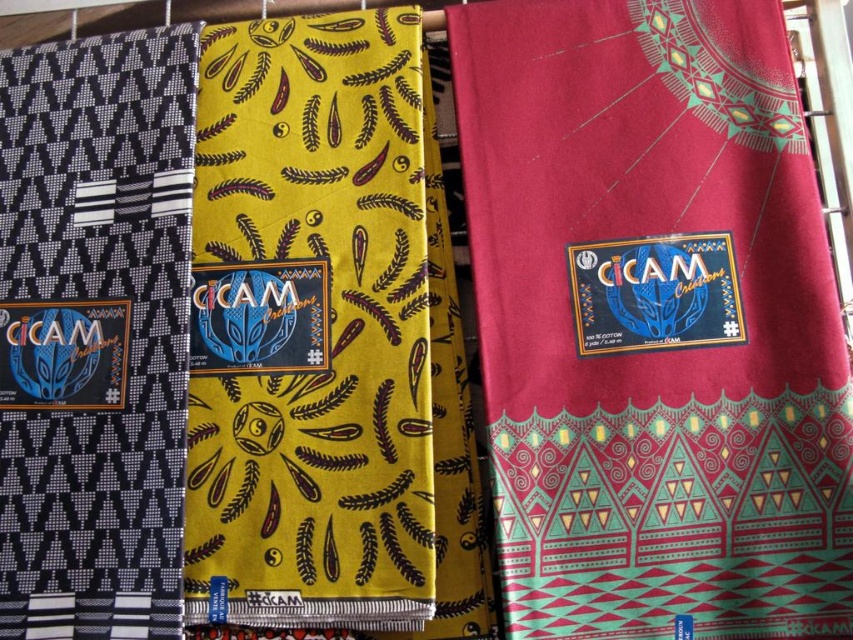
Question: Which object is farther from the camera taking this photo?

Choices:
 (A) matte red fabric at center
 (B) black woven cloth at left

Answer: (B)

Question: Considering the real-world distances, which object is closest to the black woven cloth at left?

Choices:
 (A) matte red fabric at center
 (B) yellow cotton fabric at center

Answer: (B)

Question: Estimate the real-world distances between objects in this image. Which object is closer to the yellow cotton fabric at center?

Choices:
 (A) matte red fabric at center
 (B) black woven cloth at left

Answer: (B)

Question: Can you confirm if matte red fabric at center is thinner than black woven cloth at left?

Choices:
 (A) no
 (B) yes

Answer: (A)

Question: From the image, what is the correct spatial relationship of matte red fabric at center in relation to yellow cotton fabric at center?

Choices:
 (A) right
 (B) left

Answer: (A)

Question: In this image, where is matte red fabric at center located relative to black woven cloth at left?

Choices:
 (A) left
 (B) right

Answer: (B)